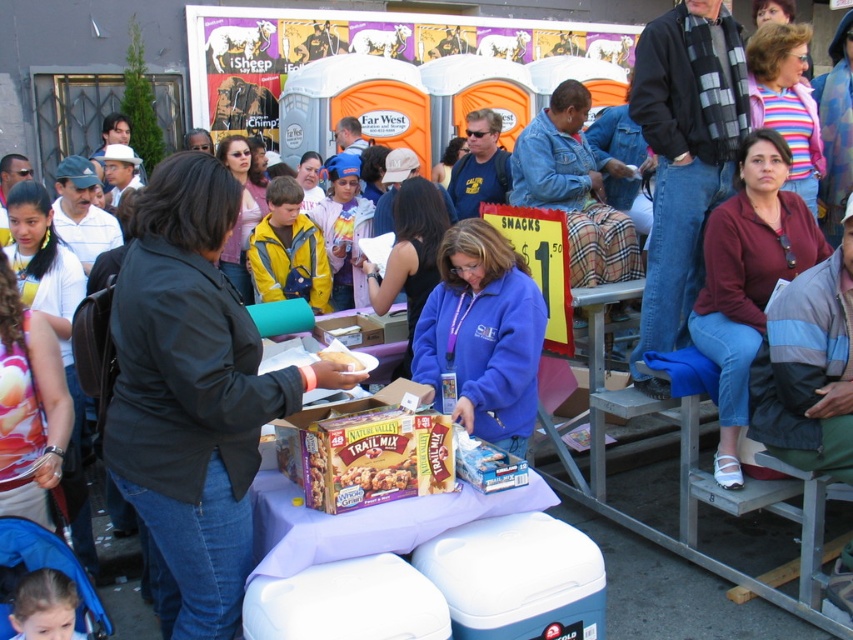
Is black matte jacket at center positioned behind blue fleece jacket at center?

That is False.

Is point (248, 561) positioned before point (471, 232)?

Yes.

Where is `black matte jacket at center`? This screenshot has width=853, height=640. black matte jacket at center is located at coordinates (192, 396).

From the picture: Is blue fleece jacket at center further to the viewer compared to maroon fabric shirt at right?

No, blue fleece jacket at center is closer to the viewer.

Is blue fleece jacket at center to the left of maroon fabric shirt at right from the viewer's perspective?

Indeed, blue fleece jacket at center is positioned on the left side of maroon fabric shirt at right.

Measure the distance between point (468, 316) and camera.

4.39 meters

Identify the location of blue fleece jacket at center. Image resolution: width=853 pixels, height=640 pixels. (482, 336).

Does blue fleece jacket at center have a lesser width compared to chocolate textured bar at center?

No.

You are a GUI agent. You are given a task and a screenshot of the screen. Output one action in this format:
    pyautogui.click(x=<x>, y=<y>)
    Task: Click on the blue fleece jacket at center
    The width and height of the screenshot is (853, 640).
    Given the screenshot: What is the action you would take?
    pyautogui.click(x=482, y=336)

This screenshot has height=640, width=853. Identify the location of blue fleece jacket at center. (482, 336).